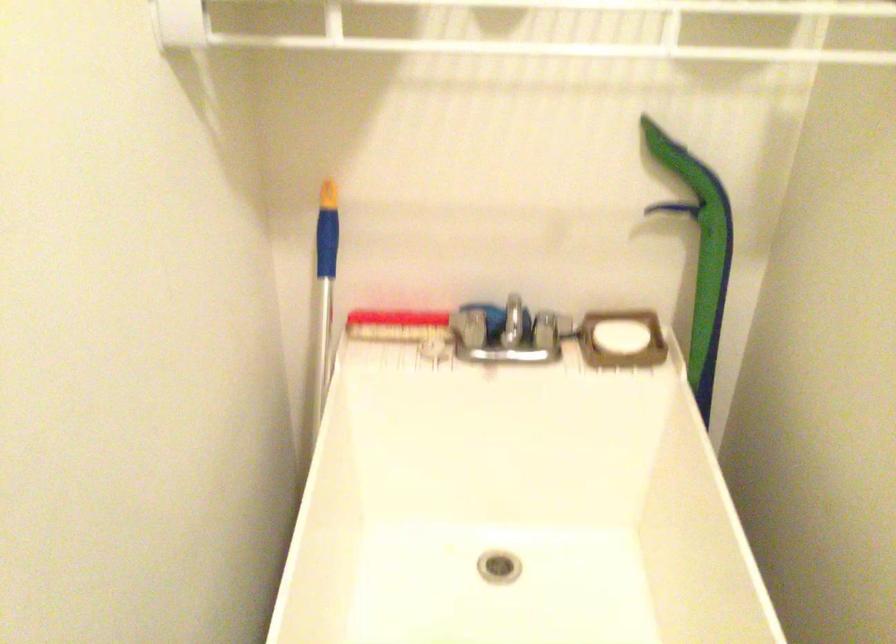
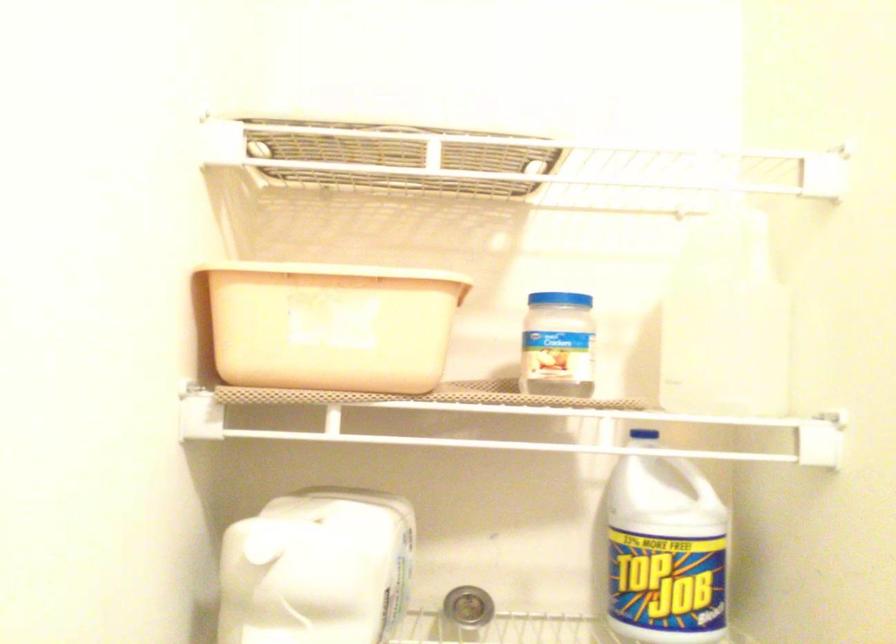
Question: The first image is from the beginning of the video and the second image is from the end. How did the camera likely rotate when shooting the video?

Choices:
 (A) Left
 (B) Right
 (C) Up
 (D) Down

Answer: (C)